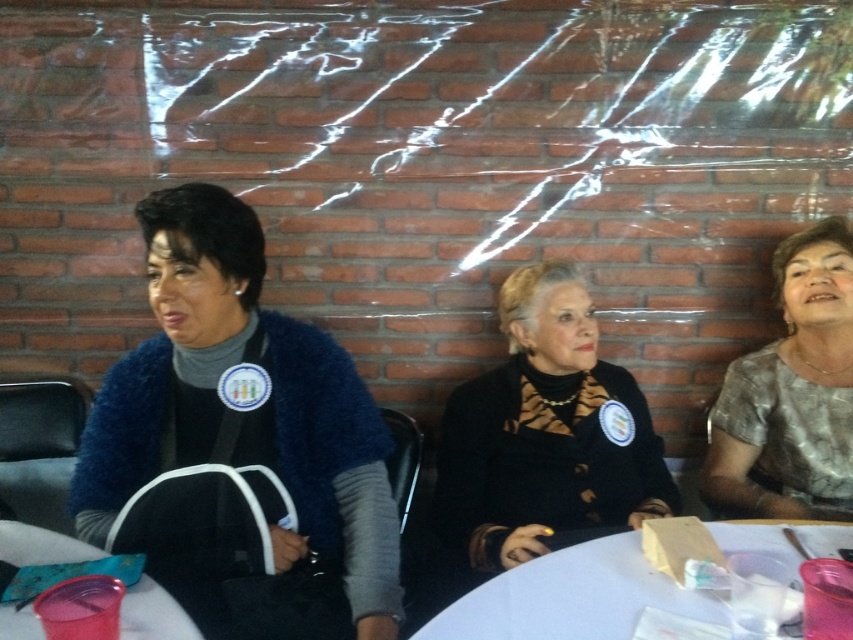
Question: Does black textured jacket at center lie behind white plastic table at center?

Choices:
 (A) yes
 (B) no

Answer: (A)

Question: Is white plastic table at center further to camera compared to translucent plastic cup at lower left?

Choices:
 (A) yes
 (B) no

Answer: (B)

Question: Considering the real-world distances, which object is closest to the translucent plastic cup at lower left?

Choices:
 (A) silver metallic blouse at right
 (B) blue fuzzy sweater at left
 (C) black textured jacket at center
 (D) white plastic table at center

Answer: (B)

Question: Is the position of black textured jacket at center more distant than that of translucent plastic cup at lower left?

Choices:
 (A) no
 (B) yes

Answer: (B)

Question: Which of the following is the closest to the observer?

Choices:
 (A) black textured jacket at center
 (B) blue fuzzy sweater at left

Answer: (B)

Question: Which of the following is the closest to the observer?

Choices:
 (A) (183, 394)
 (B) (613, 586)

Answer: (B)